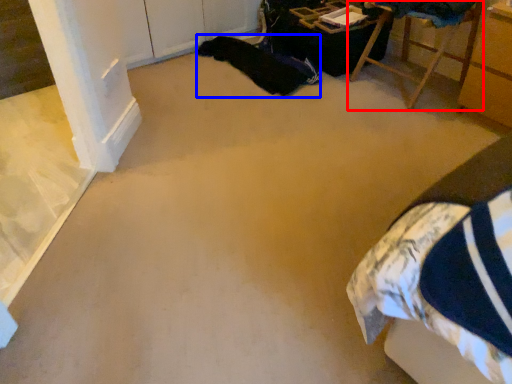
Question: Which of the following is the farthest to the observer, furniture (highlighted by a red box) or blanket (highlighted by a blue box)?

Choices:
 (A) furniture
 (B) blanket

Answer: (B)